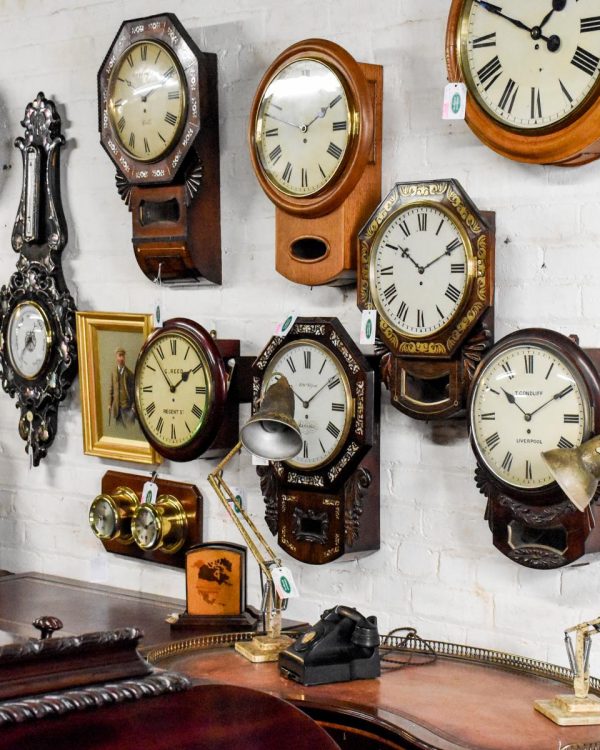
This screenshot has width=600, height=750. I want to click on clocks on wall, so click(x=146, y=112), click(x=276, y=112), click(x=535, y=73), click(x=442, y=232), click(x=515, y=361), click(x=339, y=372), click(x=160, y=372), click(x=38, y=337).